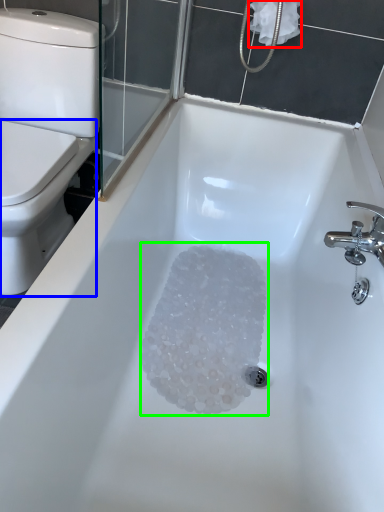
Question: Estimate the real-world distances between objects in this image. Which object is closer to toilet paper (highlighted by a red box), bidet (highlighted by a blue box) or crystal (highlighted by a green box)?

Choices:
 (A) bidet
 (B) crystal

Answer: (A)